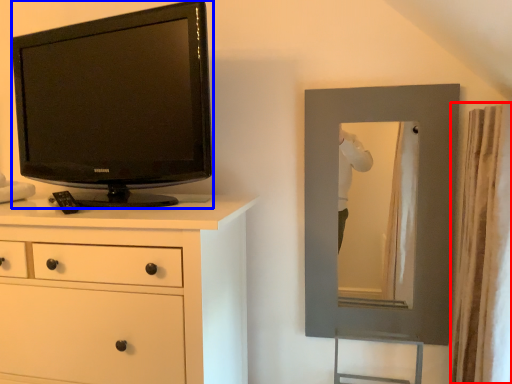
Question: Which of the following is the closest to the observer, curtain (highlighted by a red box) or television (highlighted by a blue box)?

Choices:
 (A) curtain
 (B) television

Answer: (A)